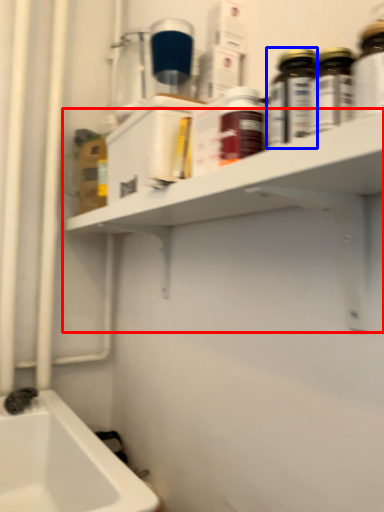
Question: Which object appears farthest to the camera in this image, shelf (highlighted by a red box) or bottle (highlighted by a blue box)?

Choices:
 (A) shelf
 (B) bottle

Answer: (B)